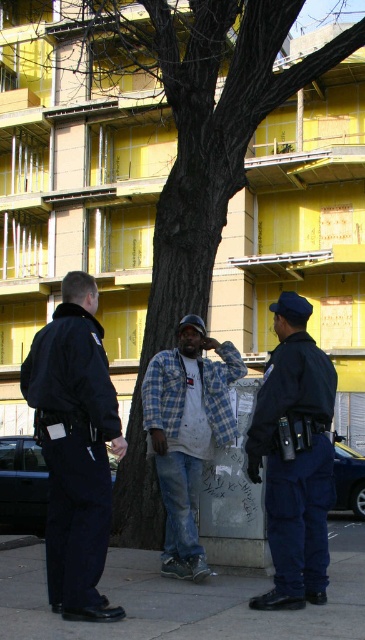
Is the position of dark blue uniform at center more distant than that of gray concrete sidewalk at center?

Yes, dark blue uniform at center is further from the viewer.

Who is taller, dark blue uniform at center or gray concrete sidewalk at center?

dark blue uniform at center

Who is more forward, (54, 595) or (104, 579)?

Point (54, 595) is in front.

Where is `dark blue uniform at center`? This screenshot has height=640, width=365. dark blue uniform at center is located at coordinates (74, 448).

Which is more to the left, blue uniformed officer at center or plaid fabric shirt at center?

From the viewer's perspective, plaid fabric shirt at center appears more on the left side.

Where is `blue uniformed officer at center`? This screenshot has width=365, height=640. blue uniformed officer at center is located at coordinates (294, 458).

Is point (306, 576) positioned in front of point (191, 321)?

Yes, point (306, 576) is in front of point (191, 321).

Where is `blue uniformed officer at center`? This screenshot has height=640, width=365. blue uniformed officer at center is located at coordinates (294, 458).

Is gray concrete sidewalk at center smaller than plaid fabric shirt at center?

Correct, gray concrete sidewalk at center occupies less space than plaid fabric shirt at center.

Which is behind, point (271, 627) or point (173, 406)?

The point (173, 406) is behind.

Image resolution: width=365 pixels, height=640 pixels. I want to click on gray concrete sidewalk at center, so click(x=186, y=600).